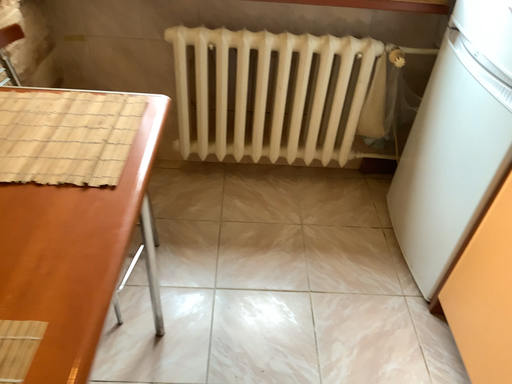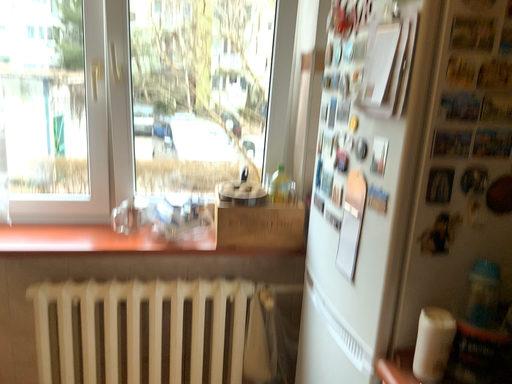
Question: How did the camera likely rotate when shooting the video?

Choices:
 (A) rotated right
 (B) rotated left

Answer: (A)